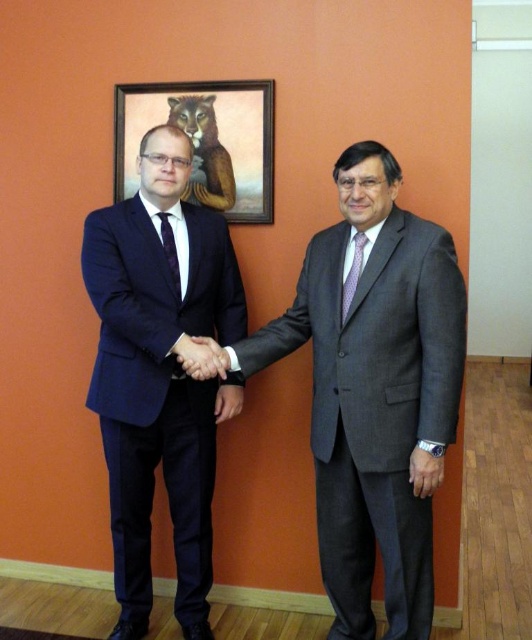
You are an interior designer asked to place a new decorative item between the gray suit at center and the wooden frame at upper center. Based on their positions, which object should the new item be closer to?

The gray suit at center is positioned on the right side of wooden frame at upper center. Therefore, the new decorative item should be placed closer to the wooden frame at upper center since the gray suit is to its right.

From the picture: Please describe the position of the matte black hand at center in terms of its coordinates within the image frame. The image frame is represented as a coordinate system where the bottom left corner is the origin point, and the values range from 0 to 1 along both the x and y axes. The x axis increases to the right, and the y axis increases upward. The two men in dark suits are standing in front of an orange wall with a puma painting. You must use the coordinate system to specify the exact location of the 2D

The matte black hand at center is located at coordinates approximately 0.558 on the x axis and 0.378 on the y axis within the image frame.

You are a photographer setting up for a professional photoshoot. You need to ensure that the gray suit at center and the purple silk tie at right are both visible in the frame. Based on their positions, which object should you focus on first to capture both in the shot?

The gray suit at center is positioned on the left side of purple silk tie at right. To capture both in the frame, focus on the gray suit at center first since it is closer to the left edge, ensuring the purple silk tie at right remains within the shot.